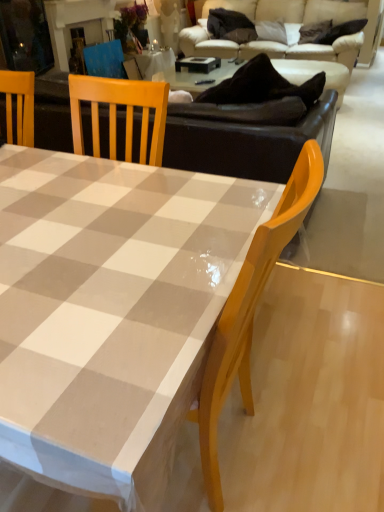
The image size is (384, 512). Find the location of `empty space that is ontop of white glossy table at center`. empty space that is ontop of white glossy table at center is located at coordinates (77, 214).